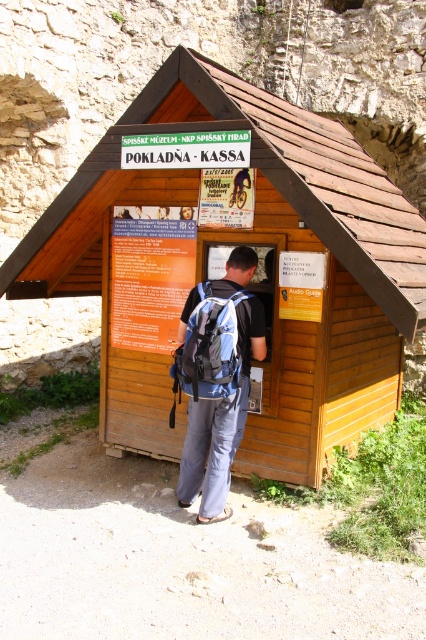
Does wooden cabin at center have a lesser height compared to blue fabric backpack at center?

No.

Who is positioned more to the right, wooden cabin at center or blue fabric backpack at center?

wooden cabin at center is more to the right.

Is point (339, 180) farther from camera compared to point (186, 371)?

Yes, point (339, 180) is farther from viewer.

Locate an element on the screen. Image resolution: width=426 pixels, height=640 pixels. wooden cabin at center is located at coordinates (273, 268).

Measure the distance from blue backpack at center to blue fabric backpack at center.

10.51 centimeters

Can you confirm if blue backpack at center is positioned below blue fabric backpack at center?

Correct, blue backpack at center is located below blue fabric backpack at center.

Between point (201, 497) and point (192, 296), which one is positioned in front?

Point (201, 497)

Find the location of a particular element. blue backpack at center is located at coordinates (216, 380).

Is the position of wooden cabin at center less distant than that of blue backpack at center?

Yes, wooden cabin at center is closer to the viewer.

Is wooden cabin at center taller than blue backpack at center?

Correct, wooden cabin at center is much taller as blue backpack at center.

Which is in front, point (221, 113) or point (198, 403)?

Positioned in front is point (221, 113).

Identify the location of wooden cabin at center. The height and width of the screenshot is (640, 426). (273, 268).